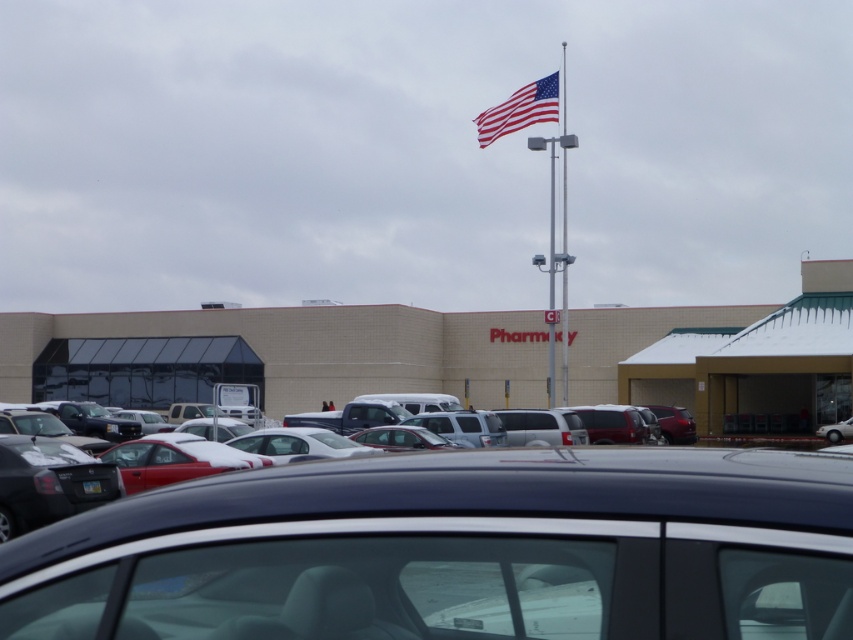
You are standing at the entrance of the pharmacy building and want to locate your car, the shiny black sedan at center. Based on the coordinates provided, can you determine if your car is parked closer to the building or the flagpole?

The coordinates of the shiny black sedan at center are at point (456, 550). Since the coordinate system typically places (0, 0) at the bottom left corner, a higher x value means it is closer to the right side. However, without additional reference points, it is impossible to determine if it is closer to the building or the flagpole.

You are standing at the point with coordinates (281, 353) in the parking lot. What is located directly beneath your feet?

The beige brick building at center is located directly beneath the point with coordinates (281, 353).